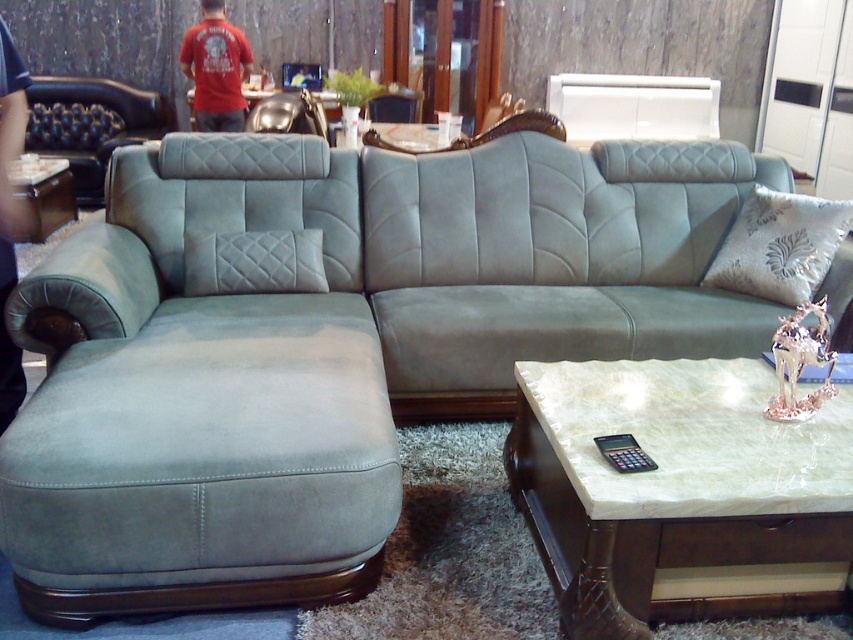
Question: Is silver textured pillow at right thinner than matte wood side table at left?

Choices:
 (A) no
 (B) yes

Answer: (A)

Question: Is suede ottoman at lower left below matte leather couch at left?

Choices:
 (A) yes
 (B) no

Answer: (A)

Question: Which object is positioned closest to the suede ottoman at lower left?

Choices:
 (A) matte wood side table at left
 (B) matte leather couch at left
 (C) metallic silver armchair at upper center
 (D) silver textured pillow at right

Answer: (D)

Question: Which point is closer to the camera?

Choices:
 (A) (573, 502)
 (B) (767, 204)

Answer: (A)

Question: Does suede ottoman at lower left have a larger size compared to metallic silver armchair at upper center?

Choices:
 (A) no
 (B) yes

Answer: (B)

Question: Based on their relative distances, which object is nearer to the matte leather couch at left?

Choices:
 (A) matte wood side table at left
 (B) metallic silver armchair at upper center
 (C) suede ottoman at lower left
 (D) marble-like coffee table at lower right

Answer: (A)